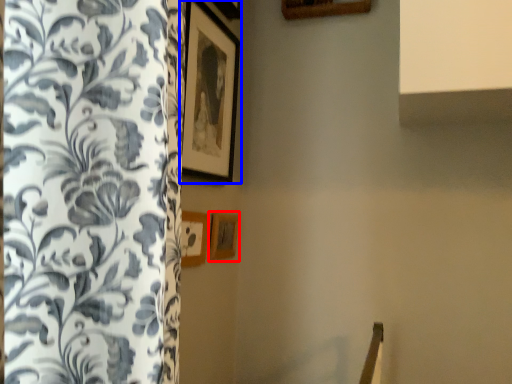
Question: Which object appears closest to the camera in this image, picture frame (highlighted by a red box) or picture frame (highlighted by a blue box)?

Choices:
 (A) picture frame
 (B) picture frame

Answer: (B)